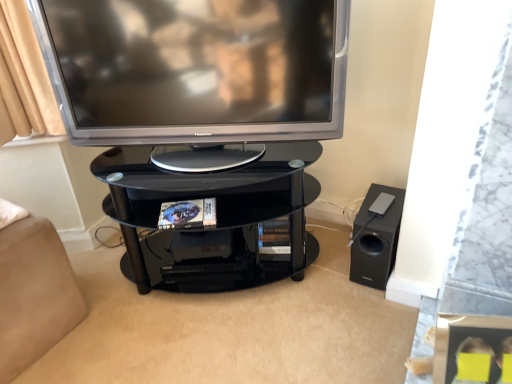
Identify the location of free space above black matte speaker at lower right (from a real-world perspective). The height and width of the screenshot is (384, 512). (381, 199).